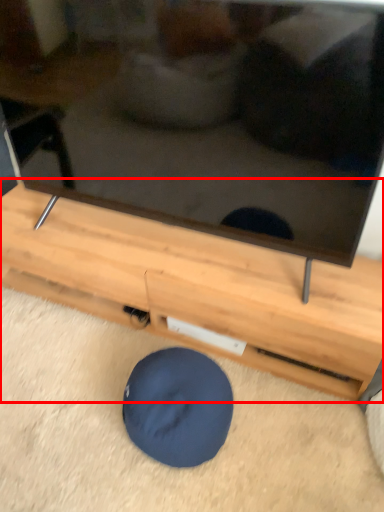
Question: Considering the relative positions of furniture (annotated by the red box) and dog bed in the image provided, where is furniture (annotated by the red box) located with respect to the staircase?

Choices:
 (A) right
 (B) left

Answer: (B)